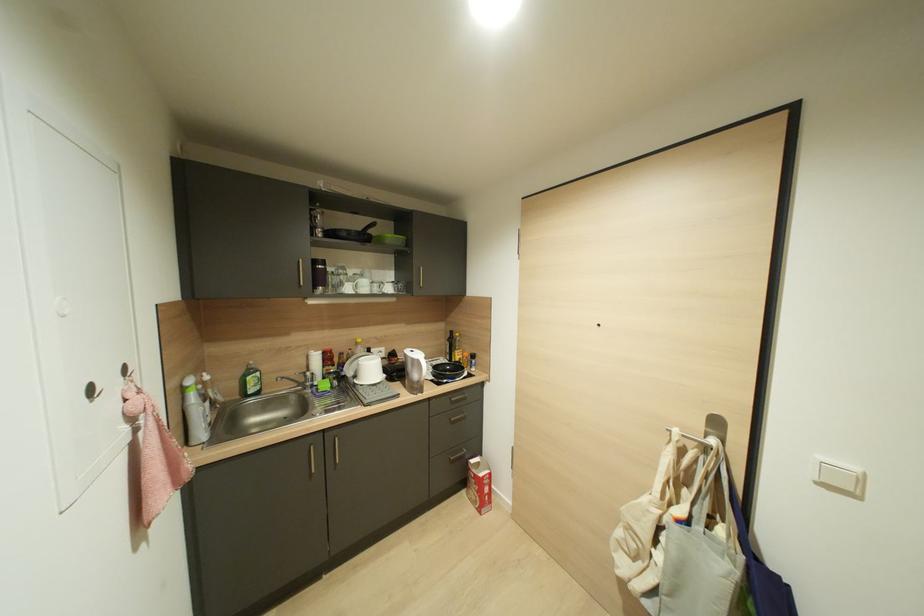
The height and width of the screenshot is (616, 924). I want to click on sink faucet handle, so click(x=299, y=379).